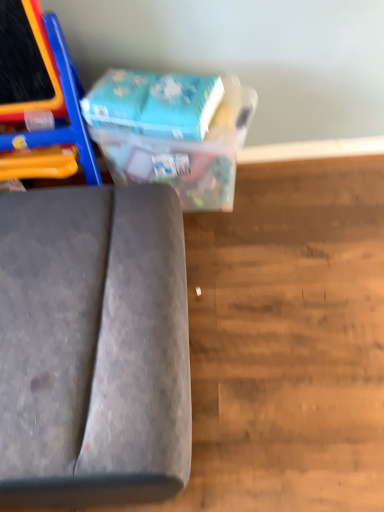
Locate an element on the screen. free space in front of blue cardboard box at upper center is located at coordinates (244, 282).